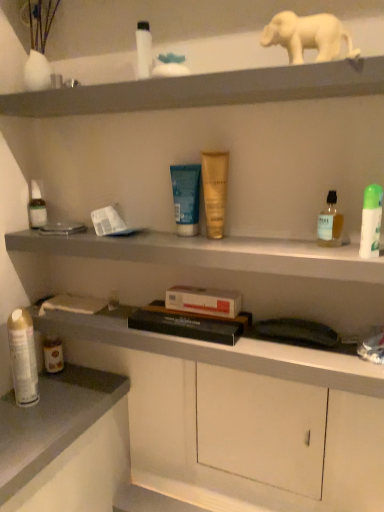
Describe the element at coordinates (52, 422) in the screenshot. The width and height of the screenshot is (384, 512). I see `smooth gray countertop at lower left` at that location.

Describe the element at coordinates (37, 206) in the screenshot. This screenshot has height=512, width=384. I see `translucent plastic bottle at left, arranged as the first toiletry when viewed from the back` at that location.

Find the location of a particular element. white matte cabinet at lower center is located at coordinates (261, 428).

Find the location of a particular element. This screenshot has height=512, width=384. hardcover book at center is located at coordinates (186, 325).

You are a GUI agent. You are given a task and a screenshot of the screen. Output one action in this format:
    pyautogui.click(x=<x>, y=<y>)
    Task: Click on the matte gray cabinet at center
    This screenshot has height=512, width=384.
    Given the screenshot: What is the action you would take?
    pyautogui.click(x=210, y=253)

The width and height of the screenshot is (384, 512). What do you see at coordinates (215, 191) in the screenshot?
I see `gold matte tube at center, which is the fourth toiletry from back to front` at bounding box center [215, 191].

Locate an element on the screen. green plastic deodorant at right, positioned as the first toiletry in right-to-left order is located at coordinates (371, 221).

Which point is more distant from viewer, (42, 223) or (23, 444)?

The point (42, 223) is farther from the camera.

Can you tell me how much translucent plastic bottle at left, the 6th toiletry positioned from the right, and smooth gray countertop at lower left differ in facing direction?

The facing directions of translucent plastic bottle at left, the 6th toiletry positioned from the right, and smooth gray countertop at lower left are 91.6 degrees apart.

In the image, there is a translucent plastic bottle at left, the 6th toiletry positioned from the right. At what (x,y) coordinates should I click in order to perform the action: click on counter top below it (from the image's perspective). Please return your answer as a coordinate pair (x, y). Looking at the image, I should click on (52, 422).

Between translucent plastic bottle at left, acting as the sixth toiletry starting from the front, and smooth gray countertop at lower left, which one has larger size?

smooth gray countertop at lower left.

In terms of height, does matte gray cabinet at center look taller or shorter compared to hardcover book at center?

In the image, matte gray cabinet at center appears to be taller than hardcover book at center.

Measure the distance from matte gray cabinet at center to hardcover book at center.

matte gray cabinet at center is 7.25 inches from hardcover book at center.

Is point (297, 251) closer to viewer compared to point (167, 312)?

Yes, point (297, 251) is closer to viewer.

In the scene shown: Is matte gray cabinet at center far from hardcover book at center?

That's not correct — matte gray cabinet at center is a little close to hardcover book at center.

Is matte gray cabinet at center wider than metallic gray shelf at lower left, which is counted as the 1th shelf, starting from the bottom?

Correct, the width of matte gray cabinet at center exceeds that of metallic gray shelf at lower left, which is counted as the 1th shelf, starting from the bottom.

Are matte gray cabinet at center and metallic gray shelf at lower left, positioned as the 2th shelf in top-to-bottom order, beside each other?

Yes, matte gray cabinet at center is beside metallic gray shelf at lower left, positioned as the 2th shelf in top-to-bottom order.

Consider the image. Would you say metallic gray shelf at lower left, which is counted as the 1th shelf, starting from the bottom, is part of matte gray cabinet at center's contents?

No, matte gray cabinet at center does not contain metallic gray shelf at lower left, which is counted as the 1th shelf, starting from the bottom.

How different are the orientations of translucent plastic bottle at left, arranged as the first toiletry when viewed from the back, and matte gray cabinet at center in degrees?

translucent plastic bottle at left, arranged as the first toiletry when viewed from the back, and matte gray cabinet at center are facing 0.00677 degrees away from each other.

Does translucent plastic bottle at left, placed as the 1th toiletry when sorted from left to right, have a smaller size compared to matte gray cabinet at center?

Yes.

Relative to matte gray cabinet at center, is translucent plastic bottle at left, acting as the sixth toiletry starting from the front, in front or behind?

Clearly, translucent plastic bottle at left, acting as the sixth toiletry starting from the front, is behind matte gray cabinet at center.

Where is `shelf above the metallic gray shelf at lower left, positioned as the 2th shelf in top-to-bottom order (from the image's perspective)`? The width and height of the screenshot is (384, 512). shelf above the metallic gray shelf at lower left, positioned as the 2th shelf in top-to-bottom order (from the image's perspective) is located at coordinates [x=189, y=33].

Is metallic gray shelf at lower left, positioned as the 2th shelf in top-to-bottom order, at the back of matte gray shelf at upper center, the 1th shelf viewed from the top?

matte gray shelf at upper center, the 1th shelf viewed from the top, is not turned away from metallic gray shelf at lower left, positioned as the 2th shelf in top-to-bottom order.

In terms of width, does matte gray shelf at upper center, placed as the second shelf when sorted from bottom to top, look wider or thinner when compared to metallic gray shelf at lower left, positioned as the 2th shelf in top-to-bottom order?

Clearly, matte gray shelf at upper center, placed as the second shelf when sorted from bottom to top, has more width compared to metallic gray shelf at lower left, positioned as the 2th shelf in top-to-bottom order.

Is white matte elephant at upper center facing towards metallic silver spray can at lower left, the 2th toiletry viewed from the back?

No, white matte elephant at upper center is not aimed at metallic silver spray can at lower left, the 2th toiletry viewed from the back.

Where is `toiletry that is the 5th object located behind the white matte elephant at upper center`? The width and height of the screenshot is (384, 512). toiletry that is the 5th object located behind the white matte elephant at upper center is located at coordinates (x=23, y=357).

Is there a large distance between white matte elephant at upper center and metallic silver spray can at lower left, positioned as the 2th toiletry in left-to-right order?

No.

Based on the photo, is clear glass bottle at upper right, which appears as the 5th toiletry when viewed from the left, not within matte gray cabinet at center?

clear glass bottle at upper right, which appears as the 5th toiletry when viewed from the left, lies outside matte gray cabinet at center's area.

Is clear glass bottle at upper right, which appears as the 2th toiletry when viewed from the front, next to matte gray cabinet at center?

They are not placed beside each other.

Measure the distance from clear glass bottle at upper right, which appears as the 2th toiletry when viewed from the front, to matte gray cabinet at center.

clear glass bottle at upper right, which appears as the 2th toiletry when viewed from the front, is 23.10 centimeters from matte gray cabinet at center.

Image resolution: width=384 pixels, height=512 pixels. What are the coordinates of `counter top in front of the translucent plastic bottle at left, placed as the 1th toiletry when sorted from left to right` in the screenshot? It's located at (52, 422).

Locate an element on the screen. The width and height of the screenshot is (384, 512). book located underneath the matte gray cabinet at center (from a real-world perspective) is located at coordinates (186, 325).

Which object lies nearer to the anchor point clear glass bottle at upper right, marked as the 5th toiletry in a back-to-front arrangement, matte gray shelf at upper center, placed as the second shelf when sorted from bottom to top, or hardcover book at center?

Among the two, hardcover book at center is located nearer to clear glass bottle at upper right, marked as the 5th toiletry in a back-to-front arrangement.

Estimate the real-world distances between objects in this image. Which object is further from translucent plastic bottle at left, the 6th toiletry positioned from the right, blue matte tube at center, marked as the fourth toiletry in a front-to-back arrangement, or matte gray shelf at upper center, placed as the second shelf when sorted from bottom to top?

matte gray shelf at upper center, placed as the second shelf when sorted from bottom to top, is positioned further to the anchor translucent plastic bottle at left, the 6th toiletry positioned from the right.

Which object lies nearer to the anchor point blue matte tube at center, the fourth toiletry positioned from the right, smooth gray countertop at lower left or metallic silver spray can at lower left, which is the 5th toiletry from front to back?

metallic silver spray can at lower left, which is the 5th toiletry from front to back.

From the image, which object appears to be farther from matte gray cabinet at center, green plastic deodorant at right, arranged as the sixth toiletry when viewed from the left, or clear glass bottle at upper right, placed as the second toiletry when sorted from right to left?

green plastic deodorant at right, arranged as the sixth toiletry when viewed from the left, is further to matte gray cabinet at center.

Based on their spatial positions, is clear glass bottle at upper right, which appears as the 5th toiletry when viewed from the left, or matte gray shelf at upper center, the 1th shelf viewed from the top, closer to metallic gray shelf at lower left, positioned as the 2th shelf in top-to-bottom order?

clear glass bottle at upper right, which appears as the 5th toiletry when viewed from the left.

Consider the image. When comparing their distances from white matte elephant at upper center, does matte gray cabinet at center or green plastic deodorant at right, arranged as the sixth toiletry when viewed from the left, seem further?

The object further to white matte elephant at upper center is matte gray cabinet at center.

Based on their spatial positions, is white matte cabinet at lower center or smooth gray countertop at lower left closer to translucent plastic bottle at left, placed as the 1th toiletry when sorted from left to right?

smooth gray countertop at lower left lies closer to translucent plastic bottle at left, placed as the 1th toiletry when sorted from left to right, than the other object.

When comparing their distances from clear glass bottle at upper right, placed as the second toiletry when sorted from right to left, does matte gray cabinet at center or smooth gray countertop at lower left seem closer?

Among the two, matte gray cabinet at center is located nearer to clear glass bottle at upper right, placed as the second toiletry when sorted from right to left.

Where is `cabinet between blue matte tube at center, placed as the 3th toiletry when sorted from left to right, and clear glass bottle at upper right, which appears as the 5th toiletry when viewed from the left`? Image resolution: width=384 pixels, height=512 pixels. cabinet between blue matte tube at center, placed as the 3th toiletry when sorted from left to right, and clear glass bottle at upper right, which appears as the 5th toiletry when viewed from the left is located at coordinates (210, 253).

The image size is (384, 512). I want to click on cabinet between blue matte tube at center, placed as the 3th toiletry when sorted from left to right, and smooth gray countertop at lower left in the up-down direction, so click(210, 253).

Where is `drawer between translucent plastic bottle at left, arranged as the first toiletry when viewed from the back, and clear glass bottle at upper right, placed as the second toiletry when sorted from right to left, from left to right`? The height and width of the screenshot is (512, 384). drawer between translucent plastic bottle at left, arranged as the first toiletry when viewed from the back, and clear glass bottle at upper right, placed as the second toiletry when sorted from right to left, from left to right is located at coordinates (261, 428).

Locate an element on the screen. The height and width of the screenshot is (512, 384). cabinet between metallic silver spray can at lower left, which is counted as the 5th toiletry, starting from the right, and clear glass bottle at upper right, which appears as the 2th toiletry when viewed from the front, in the horizontal direction is located at coordinates (210, 253).